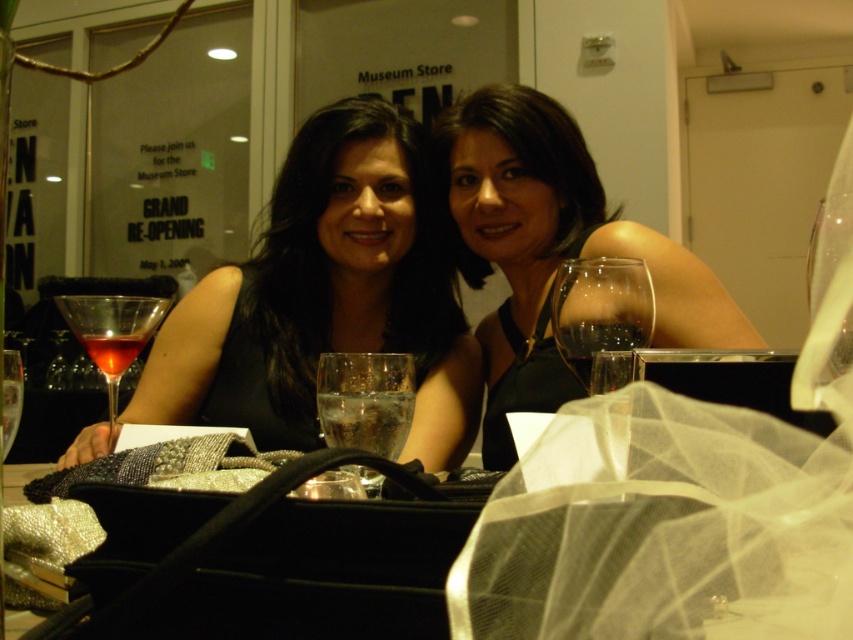
Question: Does transparent glass at center have a greater width compared to translucent glass wine at center?

Choices:
 (A) no
 (B) yes

Answer: (A)

Question: Does black satin dress at center have a greater width compared to clear glass water at center?

Choices:
 (A) no
 (B) yes

Answer: (B)

Question: Which of the following is the closest to the observer?

Choices:
 (A) (9, 440)
 (B) (583, 305)
 (C) (122, 360)

Answer: (B)

Question: Among these points, which one is nearest to the camera?

Choices:
 (A) (7, 358)
 (B) (590, 346)

Answer: (A)

Question: Does matte black dress at center lie in front of translucent glass martini at left?

Choices:
 (A) no
 (B) yes

Answer: (A)

Question: Which object is the closest to the transparent glass at center?

Choices:
 (A) clear glass wine glass at left
 (B) translucent glass martini at left
 (C) matte black dress at center
 (D) clear glass at center

Answer: (D)